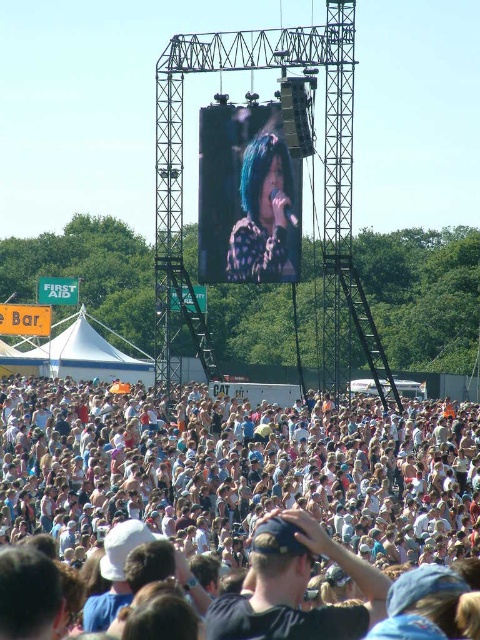
You are a photographer at the concert. You want to capture a photo that includes both the white cotton crowd at lower center and the shiny purple hair at center. Which object should you focus on first to ensure both are in frame?

The white cotton crowd at lower center is bigger than the shiny purple hair at center, so you should focus on the white cotton crowd at lower center first to ensure both fit in the frame.

You are a photographer at the concert and want to capture a photo of the shiny purple hair at center without the white cotton crowd at lower center blocking the view. Which direction should you move to ensure the crowd is out of the frame?

The white cotton crowd at lower center is to the left of shiny purple hair at center, so moving to the right side would position the crowd out of the frame.

You are a photographer at the concert and want to capture a photo that includes both the white cotton crowd at lower center and the shiny purple hair at center. Based on their positions, which object should appear lower in the photo?

The white cotton crowd at lower center should appear lower in the photo because it is positioned below the shiny purple hair at center.